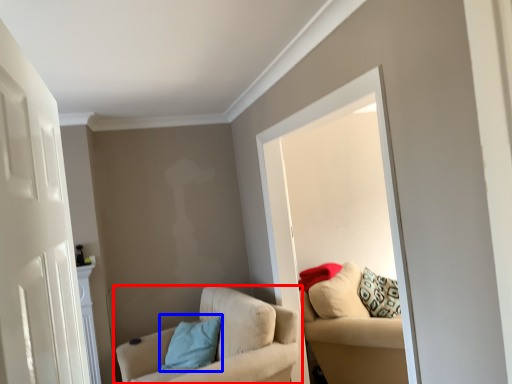
Question: Which object is further to the camera taking this photo, chair (highlighted by a red box) or pillow (highlighted by a blue box)?

Choices:
 (A) chair
 (B) pillow

Answer: (B)